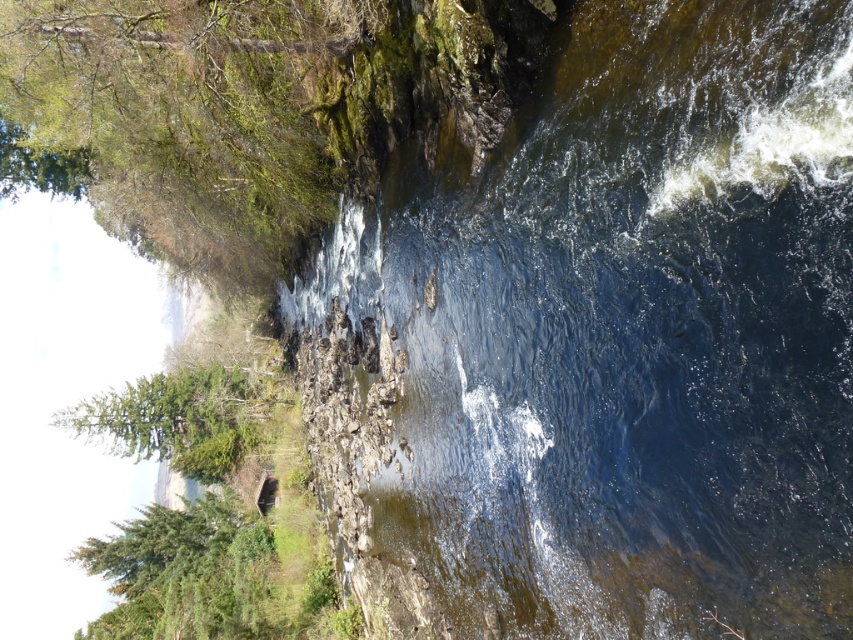
Question: Which object is positioned farthest from the clear water at center?

Choices:
 (A) green mossy rock at upper left
 (B) green matte tree at lower left

Answer: (B)

Question: Which of these objects is positioned farthest from the green matte tree at lower left?

Choices:
 (A) clear water at center
 (B) green mossy rock at upper left

Answer: (A)

Question: Which point is farther to the camera?

Choices:
 (A) green matte tree at lower left
 (B) green matte tree at left

Answer: (B)

Question: Is clear water at center smaller than green mossy rock at upper left?

Choices:
 (A) no
 (B) yes

Answer: (B)

Question: Can you confirm if green mossy rock at upper left is positioned below green matte tree at lower left?

Choices:
 (A) no
 (B) yes

Answer: (A)

Question: Can you confirm if clear water at center is positioned below green mossy rock at upper left?

Choices:
 (A) yes
 (B) no

Answer: (A)